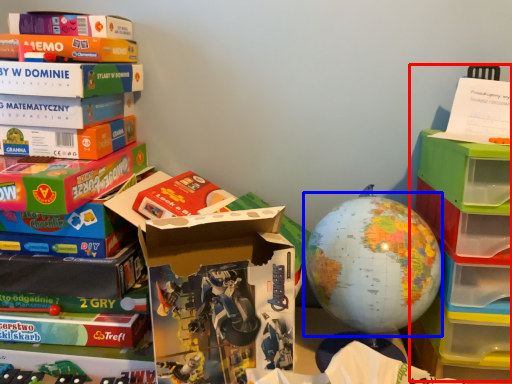
Question: Among these objects, which one is nearest to the camera, shelf (highlighted by a red box) or earth (highlighted by a blue box)?

Choices:
 (A) shelf
 (B) earth

Answer: (A)